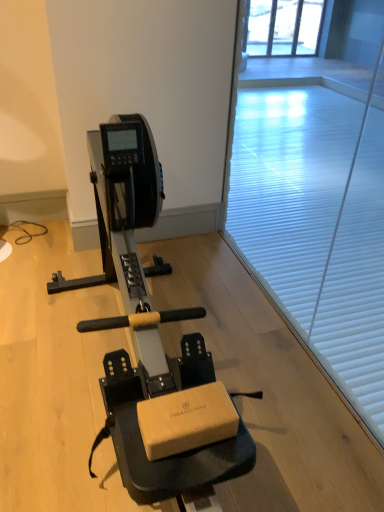
Image resolution: width=384 pixels, height=512 pixels. I want to click on free space to the left of white matte window screen at center, so click(160, 306).